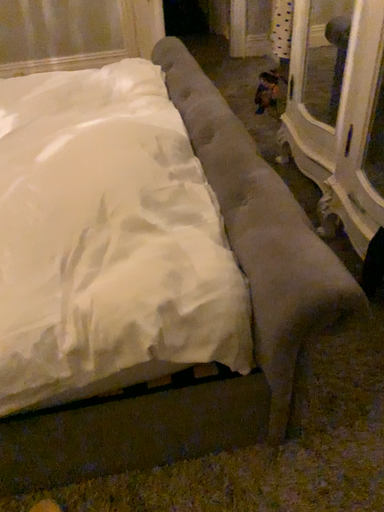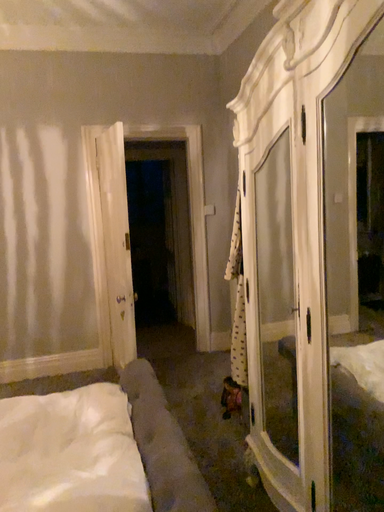
Question: How did the camera likely rotate when shooting the video?

Choices:
 (A) rotated upward
 (B) rotated downward

Answer: (A)